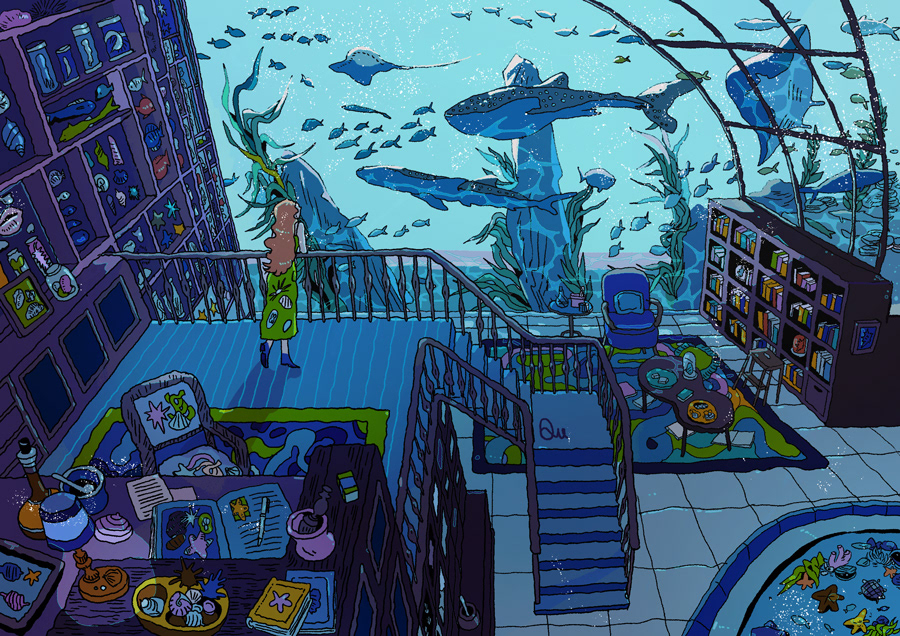
Find the location of a particular element. The height and width of the screenshot is (636, 900). chair is located at coordinates (639, 315), (185, 458).